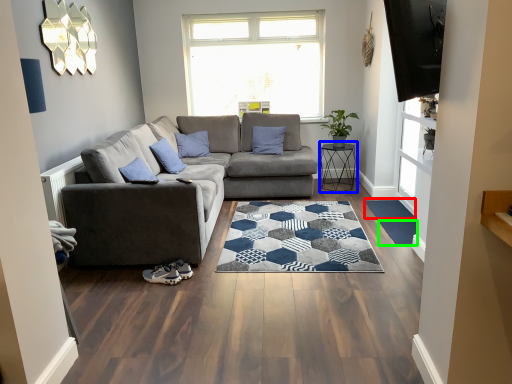
Question: Which object is positioned farthest from flat (highlighted by a red box)? Select from table (highlighted by a blue box) and mat (highlighted by a green box).

Choices:
 (A) table
 (B) mat

Answer: (A)